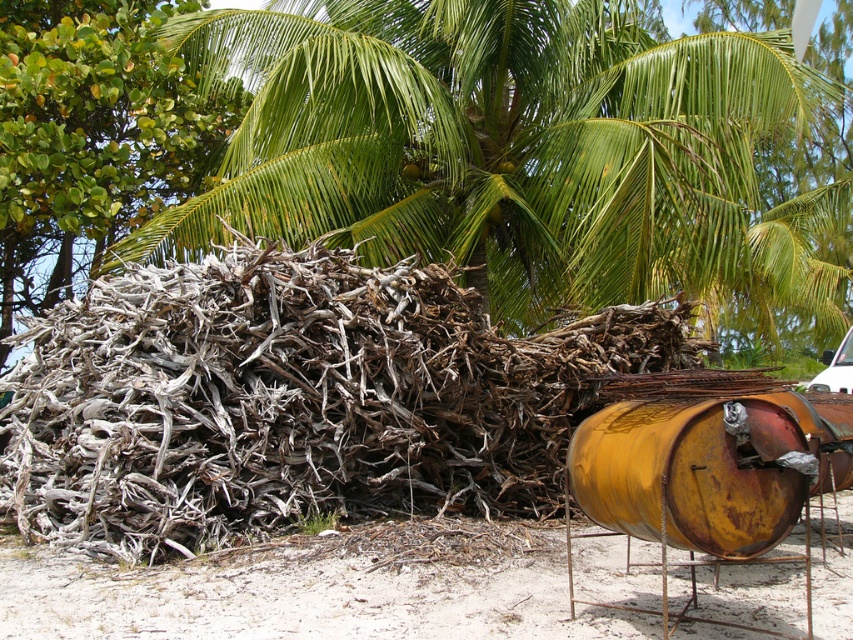
Question: Estimate the real-world distances between objects in this image. Which object is farther from the white driftwood at center?

Choices:
 (A) rusty metallic barrel at right
 (B) white sand at lower left

Answer: (A)

Question: Does white driftwood at center have a lesser width compared to white sand at lower left?

Choices:
 (A) no
 (B) yes

Answer: (A)

Question: Among these points, which one is farthest from the camera?

Choices:
 (A) (260, 292)
 (B) (776, 525)
 (C) (496, 586)

Answer: (A)

Question: Which object is the farthest from the rusty metallic barrel at right?

Choices:
 (A) gray driftwood at left
 (B) white driftwood at center
 (C) white sand at lower left
 (D) green leafy coconut tree at upper center

Answer: (A)

Question: Can you confirm if green leafy coconut tree at upper center is bigger than white sand at lower left?

Choices:
 (A) yes
 (B) no

Answer: (A)

Question: Does green leafy coconut tree at upper center appear on the left side of white sand at lower left?

Choices:
 (A) no
 (B) yes

Answer: (A)